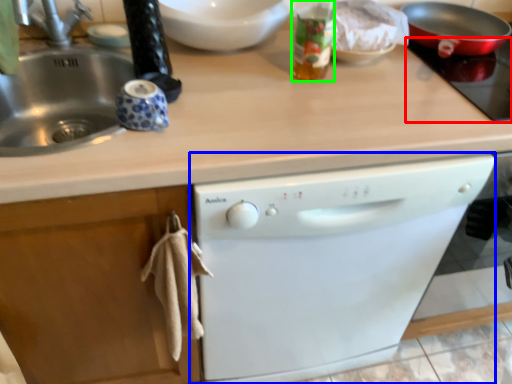
Question: Based on their relative distances, which object is farther from gas stove (highlighted by a red box)? Choose from dishwasher (highlighted by a blue box) and bottle (highlighted by a green box).

Choices:
 (A) dishwasher
 (B) bottle

Answer: (A)